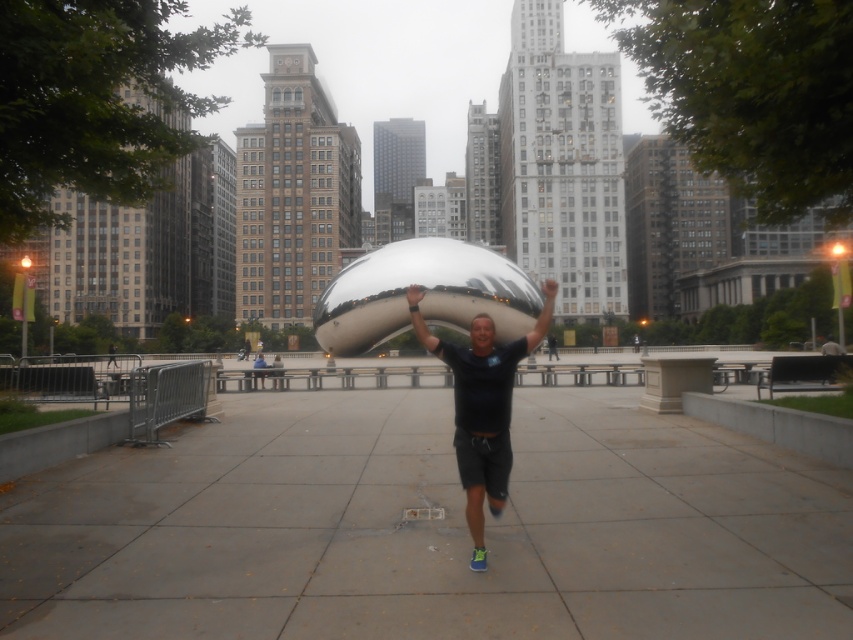
You are standing at the origin point in the image and want to reach the gray concrete pavement at center. What are the coordinates you need to move to?

The gray concrete pavement at center is located at coordinates point (430, 529).

You are a photographer aiming to capture the reflection of the black matte shirt at center in the gray concrete pavement at center. Based on their positions, is it possible to achieve this reflection?

The gray concrete pavement at center is positioned on the left side of black matte shirt at center, so the black matte shirt at center is not directly above the gray concrete pavement at center. Therefore, it is unlikely to capture the reflection of the black matte shirt at center in the gray concrete pavement at center unless the photographer moves to adjust the angle.

You are a photographer trying to capture a photo of the smooth skin head at center without including the gray concrete pavement at center in the frame. Is this possible given their positions?

The gray concrete pavement at center is in front of the smooth skin head at center, so it would block the view of the head. Therefore, it is not possible to capture the smooth skin head at center without including the gray concrete pavement at center in the frame.